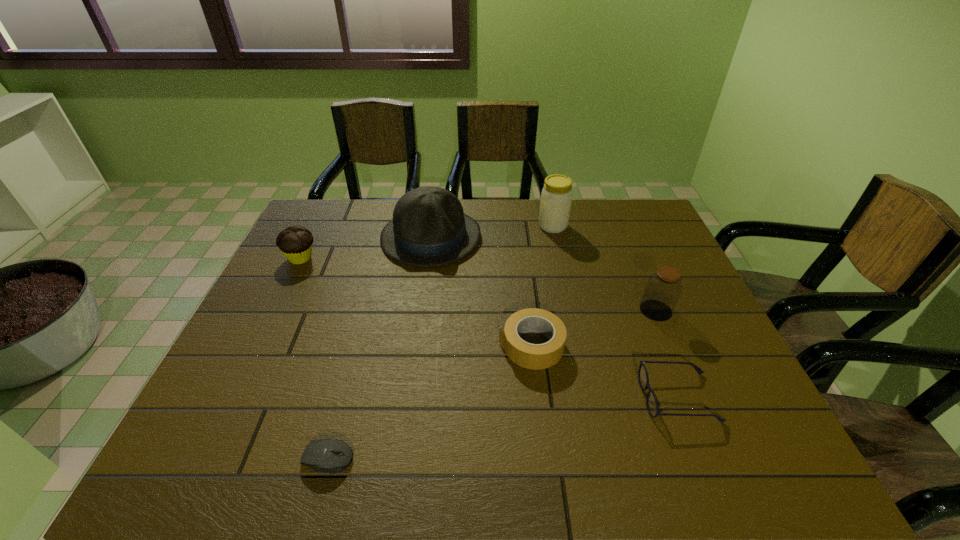
Where is `vacant space located on the front-facing side of the spectacles`? The height and width of the screenshot is (540, 960). vacant space located on the front-facing side of the spectacles is located at coordinates (466, 397).

The width and height of the screenshot is (960, 540). What are the coordinates of `blank space located 0.200m on the back of the shortest object` in the screenshot? It's located at (353, 363).

Find the location of a particular element. jar that is at the far edge is located at coordinates (556, 197).

The width and height of the screenshot is (960, 540). I want to click on bowler hat at the far edge, so click(429, 228).

The image size is (960, 540). What are the coordinates of `object that is positioned at the near edge` in the screenshot? It's located at (318, 455).

Image resolution: width=960 pixels, height=540 pixels. What are the coordinates of `object located at the left edge` in the screenshot? It's located at (295, 242).

Where is `jar at the right edge`? Image resolution: width=960 pixels, height=540 pixels. jar at the right edge is located at coordinates (664, 287).

Where is `spectacles located in the right edge section of the desktop`? spectacles located in the right edge section of the desktop is located at coordinates tap(652, 404).

The height and width of the screenshot is (540, 960). In order to click on free space at the far edge of the desktop in this screenshot , I will do `click(506, 202)`.

The height and width of the screenshot is (540, 960). I want to click on vacant space at the near edge of the desktop, so click(695, 461).